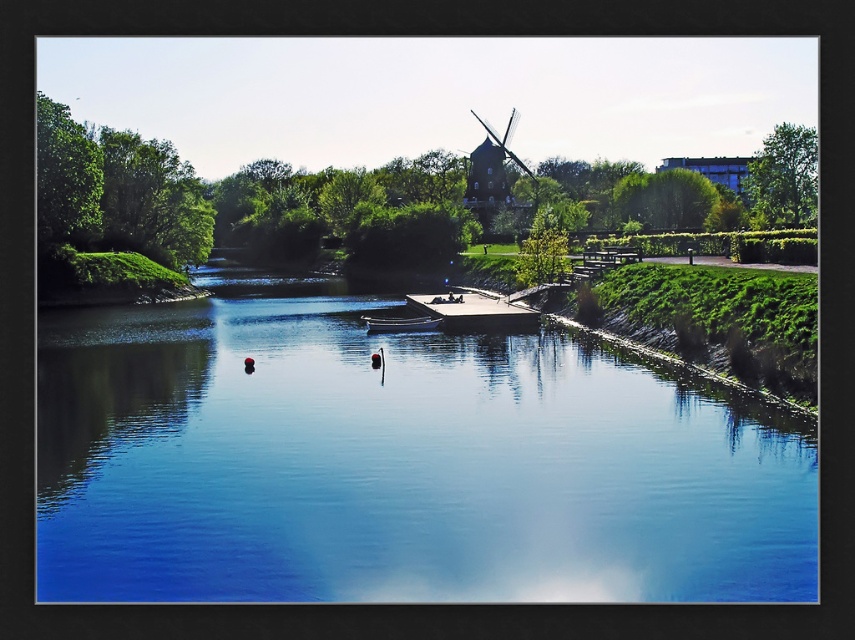
Consider the image. Can you confirm if blue smooth water at center is bigger than blue glossy boat at center?

Indeed, blue smooth water at center has a larger size compared to blue glossy boat at center.

Can you confirm if blue smooth water at center is taller than blue glossy boat at center?

Indeed, blue smooth water at center has a greater height compared to blue glossy boat at center.

Which is behind, point (343, 420) or point (394, 324)?

Point (394, 324)

The height and width of the screenshot is (640, 855). I want to click on blue smooth water at center, so click(x=397, y=461).